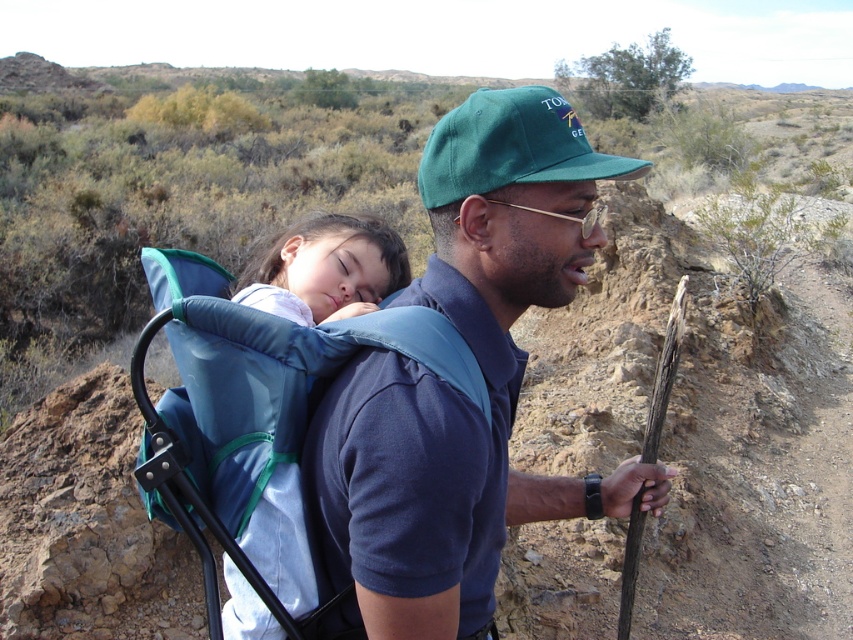
You are a hiker planning to cross a desert. You have a blue fabric backpack at upper left and a green fabric baseball cap at center. Which item is closer to you from your perspective?

The blue fabric backpack at upper left is closer to you because it is in front of the green fabric baseball cap at center.

You are a hiker who needs to adjust your gear. You have a blue fabric backpack at upper left and a green fabric baseball cap at center. Which item is located higher up relative to the other?

The green fabric baseball cap at center is higher up because the blue fabric backpack at upper left is positioned under it.

You are a hiker trying to determine the best path to avoid steep slopes. You notice two points marked on your map corresponding to coordinates in the scene. The first point is at coordinate point (467, 493), and the second point is at coordinate point (587, 154). Which point is closer to your current position?

Point (467, 493) is closer to the viewer than point (587, 154), so the first point is closer to your current position.